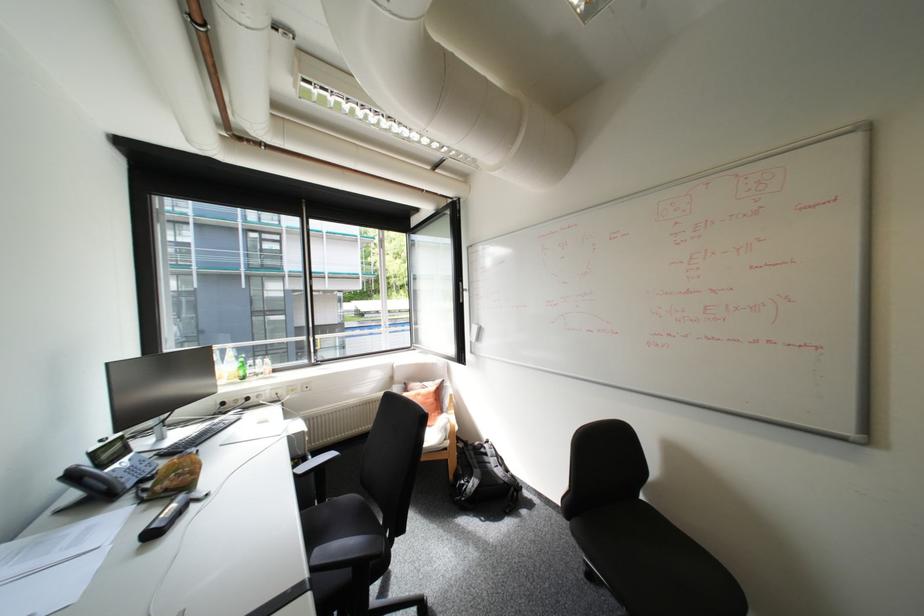
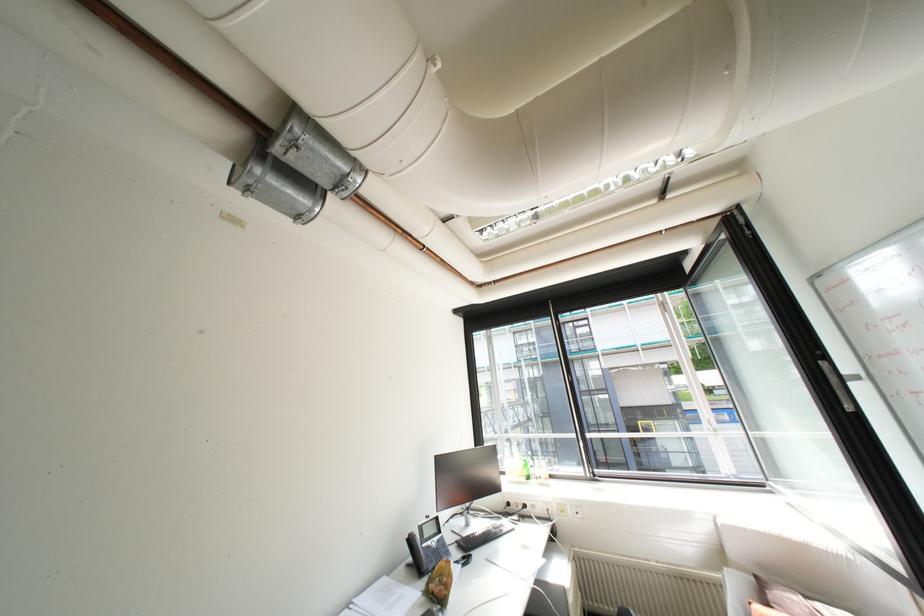
How did the camera likely rotate?

The camera's rotation is toward left-up.